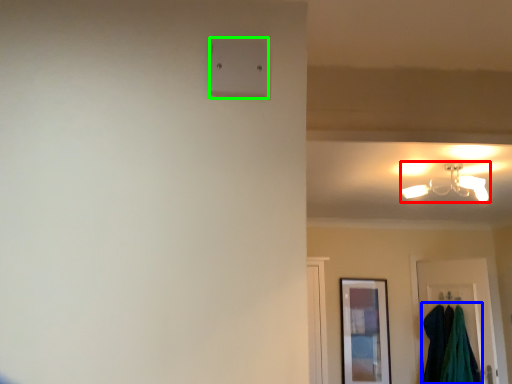
Question: Which is nearer to the lamp (highlighted by a red box)? laundry (highlighted by a blue box) or light switch (highlighted by a green box).

Choices:
 (A) laundry
 (B) light switch

Answer: (A)